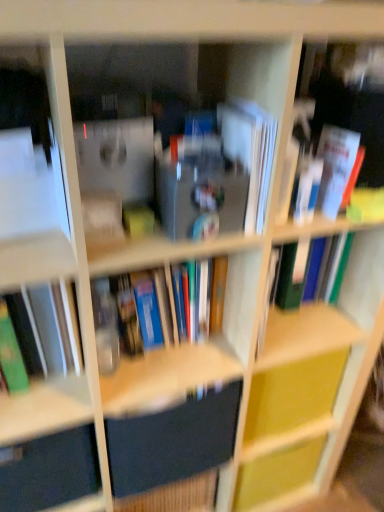
Find the location of a particular element. This screenshot has width=384, height=512. white paper book at right, marked as the third book in a left-to-right arrangement is located at coordinates (326, 174).

The image size is (384, 512). Find the location of `hardcover book at center, the second book in the left-to-right sequence`. hardcover book at center, the second book in the left-to-right sequence is located at coordinates (145, 308).

Describe the element at coordinates (145, 308) in the screenshot. I see `hardcover book at center, the second book in the left-to-right sequence` at that location.

How much space does white paper at center, arranged as the 2th paperback book when ordered from the bottom, occupy horizontally?

The width of white paper at center, arranged as the 2th paperback book when ordered from the bottom, is 8.80 inches.

At what (x,y) coordinates should I click in order to perform the action: click on yellow matte cabinet at center. Please return your answer as a coordinate pair (x, y). The width and height of the screenshot is (384, 512). Looking at the image, I should click on (293, 394).

Considering the relative positions of white paper book at right, marked as the third book in a left-to-right arrangement, and yellow matte cabinet at center in the image provided, is white paper book at right, marked as the third book in a left-to-right arrangement, to the right of yellow matte cabinet at center from the viewer's perspective?

Yes, white paper book at right, marked as the third book in a left-to-right arrangement, is to the right of yellow matte cabinet at center.

Considering the sizes of objects white paper book at right, which appears as the 2th book when viewed from the right, and yellow matte cabinet at center in the image provided, who is wider, white paper book at right, which appears as the 2th book when viewed from the right, or yellow matte cabinet at center?

With larger width is white paper book at right, which appears as the 2th book when viewed from the right.

Is white paper book at right, marked as the third book in a left-to-right arrangement, bigger or smaller than yellow matte cabinet at center?

Considering their sizes, white paper book at right, marked as the third book in a left-to-right arrangement, takes up less space than yellow matte cabinet at center.

Is yellow matte cabinet at center a part of white paper book at right, which appears as the 2th book when viewed from the right?

No.

Between hardcover book at center, the second book in the left-to-right sequence, and white paper at center, marked as the first paperback book in a top-to-bottom arrangement, which one has smaller width?

With smaller width is white paper at center, marked as the first paperback book in a top-to-bottom arrangement.

From the image's perspective, which one is positioned lower, hardcover book at center, the second book in the left-to-right sequence, or white paper at center, arranged as the 2th paperback book when ordered from the bottom?

From the image's view, hardcover book at center, the second book in the left-to-right sequence, is below.

From a real-world perspective, who is located higher, hardcover book at center, the second book in the left-to-right sequence, or white paper at center, marked as the first paperback book in a top-to-bottom arrangement?

white paper at center, marked as the first paperback book in a top-to-bottom arrangement, is physically above.

Is hardcover book at center, which ranks as the 3th book in right-to-left order, facing towards white paper at center, arranged as the 2th paperback book when ordered from the bottom?

No, hardcover book at center, which ranks as the 3th book in right-to-left order, is not facing towards white paper at center, arranged as the 2th paperback book when ordered from the bottom.

Measure the distance between matte black drawer at lower left and dark blue matte book at center, positioned as the second paperback book in top-to-bottom order.

They are 17.39 centimeters apart.

Considering the points (15, 498) and (221, 391), which point is behind, point (15, 498) or point (221, 391)?

The point (221, 391) is behind.

Based on their positions, is matte black drawer at lower left located to the left or right of dark blue matte book at center, positioned as the second paperback book in top-to-bottom order?

matte black drawer at lower left is positioned on dark blue matte book at center, positioned as the second paperback book in top-to-bottom order,'s left side.

Is matte black drawer at lower left next to dark blue matte book at center, positioned as the second paperback book in top-to-bottom order, and touching it?

matte black drawer at lower left is not next to dark blue matte book at center, positioned as the second paperback book in top-to-bottom order, and they're not touching.

Which of these two, hardcover book at center, the second book in the left-to-right sequence, or yellow matte cabinet at center, stands taller?

yellow matte cabinet at center.

Which object is further away from the camera taking this photo, hardcover book at center, the second book in the left-to-right sequence, or yellow matte cabinet at center?

Positioned behind is yellow matte cabinet at center.

From the picture: Do you think hardcover book at center, the second book in the left-to-right sequence, is within yellow matte cabinet at center, or outside of it?

hardcover book at center, the second book in the left-to-right sequence, lies outside yellow matte cabinet at center.

Does hardcover book at center, the second book in the left-to-right sequence, turn towards yellow matte cabinet at center?

No, hardcover book at center, the second book in the left-to-right sequence, does not turn towards yellow matte cabinet at center.

Which object is positioned more to the left, white paper at center, arranged as the 2th paperback book when ordered from the bottom, or hardcover book at center, which ranks as the 3th book in right-to-left order?

hardcover book at center, which ranks as the 3th book in right-to-left order, is more to the left.

Is white paper at center, marked as the first paperback book in a top-to-bottom arrangement, aimed at hardcover book at center, which ranks as the 3th book in right-to-left order?

No, white paper at center, marked as the first paperback book in a top-to-bottom arrangement, is not turned towards hardcover book at center, which ranks as the 3th book in right-to-left order.

Which point is more distant from viewer, (245, 230) or (95, 280)?

The point (95, 280) is farther from the camera.

Find the location of a particular element. book that is the 1st one when counting downward from the white paper at center, arranged as the 2th paperback book when ordered from the bottom (from the image's perspective) is located at coordinates (145, 308).

In the scene shown: Which object is further away from the camera taking this photo, yellow matte cabinet at center or white paper at center, marked as the first paperback book in a top-to-bottom arrangement?

yellow matte cabinet at center is further from the camera.

From a real-world perspective, between yellow matte cabinet at center and white paper at center, marked as the first paperback book in a top-to-bottom arrangement, who is vertically higher?

white paper at center, marked as the first paperback book in a top-to-bottom arrangement.

From the image's perspective, is yellow matte cabinet at center above white paper at center, marked as the first paperback book in a top-to-bottom arrangement?

No, from the image's perspective, yellow matte cabinet at center is not over white paper at center, marked as the first paperback book in a top-to-bottom arrangement.

The height and width of the screenshot is (512, 384). I want to click on paperback book above the yellow matte cabinet at center (from the image's perspective), so click(250, 152).

In the image, is dark blue matte book at center, marked as the first paperback book in a bottom-to-top arrangement, positioned in front of or behind green matte book at left, acting as the 1th book starting from the left?

Clearly, dark blue matte book at center, marked as the first paperback book in a bottom-to-top arrangement, is behind green matte book at left, acting as the 1th book starting from the left.

Is dark blue matte book at center, marked as the first paperback book in a bottom-to-top arrangement, next to green matte book at left, which ranks as the 4th book in right-to-left order?

No, dark blue matte book at center, marked as the first paperback book in a bottom-to-top arrangement, is not beside green matte book at left, which ranks as the 4th book in right-to-left order.

The height and width of the screenshot is (512, 384). I want to click on paperback book behind the green matte book at left, which ranks as the 4th book in right-to-left order, so click(x=173, y=441).

Can you confirm if dark blue matte book at center, positioned as the second paperback book in top-to-bottom order, is positioned to the right of green matte book at left, acting as the 1th book starting from the left?

Yes, dark blue matte book at center, positioned as the second paperback book in top-to-bottom order, is to the right of green matte book at left, acting as the 1th book starting from the left.

I want to click on cabinet located behind the white paper book at right, marked as the third book in a left-to-right arrangement, so click(x=293, y=394).

Which book is the 1st one when counting from the left side of the white paper at center, arranged as the 2th paperback book when ordered from the bottom? Please provide its 2D coordinates.

[(145, 308)]

Estimate the real-world distances between objects in this image. Which object is closer to yellow matte cabinet at center, matte black drawer at lower left or green matte book at left, acting as the 1th book starting from the left?

matte black drawer at lower left lies closer to yellow matte cabinet at center than the other object.

Considering their positions, is white paper book at right, which appears as the 2th book when viewed from the right, positioned further to matte black drawer at lower left than dark blue matte book at center, positioned as the second paperback book in top-to-bottom order?

white paper book at right, which appears as the 2th book when viewed from the right.

Which object lies nearer to the anchor point white paper book at right, marked as the third book in a left-to-right arrangement, white paper book at upper right, the 1th book in the right-to-left sequence, or green matte book at left, acting as the 1th book starting from the left?

Based on the image, white paper book at upper right, the 1th book in the right-to-left sequence, appears to be nearer to white paper book at right, marked as the third book in a left-to-right arrangement.

Based on their spatial positions, is white paper book at upper right, which appears as the 4th book when viewed from the left, or hardcover book at center, the second book in the left-to-right sequence, closer to green matte book at left, which ranks as the 4th book in right-to-left order?

hardcover book at center, the second book in the left-to-right sequence, is positioned closer to the anchor green matte book at left, which ranks as the 4th book in right-to-left order.

From the image, which object appears to be farther from white paper book at right, marked as the third book in a left-to-right arrangement, white paper at center, marked as the first paperback book in a top-to-bottom arrangement, or hardcover book at center, which ranks as the 3th book in right-to-left order?

The object further to white paper book at right, marked as the third book in a left-to-right arrangement, is hardcover book at center, which ranks as the 3th book in right-to-left order.

Looking at the image, which one is located closer to matte black drawer at lower left, white paper book at upper right, which appears as the 4th book when viewed from the left, or green matte book at left, acting as the 1th book starting from the left?

The object closer to matte black drawer at lower left is green matte book at left, acting as the 1th book starting from the left.

Considering their positions, is dark blue matte book at center, marked as the first paperback book in a bottom-to-top arrangement, positioned closer to hardcover book at center, the second book in the left-to-right sequence, than yellow matte cabinet at center?

dark blue matte book at center, marked as the first paperback book in a bottom-to-top arrangement, is positioned closer to the anchor hardcover book at center, the second book in the left-to-right sequence.

Which object lies nearer to the anchor point white paper at center, marked as the first paperback book in a top-to-bottom arrangement, dark blue matte book at center, positioned as the second paperback book in top-to-bottom order, or hardcover book at center, which ranks as the 3th book in right-to-left order?

hardcover book at center, which ranks as the 3th book in right-to-left order, is positioned closer to the anchor white paper at center, marked as the first paperback book in a top-to-bottom arrangement.

Find the location of `cabinet between white paper at center, marked as the first paperback book in a top-to-bottom arrangement, and dark blue matte book at center, positioned as the second paperback book in top-to-bottom order, vertically`. cabinet between white paper at center, marked as the first paperback book in a top-to-bottom arrangement, and dark blue matte book at center, positioned as the second paperback book in top-to-bottom order, vertically is located at coordinates (293, 394).

Find the location of a particular element. The width and height of the screenshot is (384, 512). cabinet that lies between white paper book at upper right, which appears as the 4th book when viewed from the left, and dark blue matte book at center, marked as the first paperback book in a bottom-to-top arrangement, from top to bottom is located at coordinates (293, 394).

Identify the location of book between hardcover book at center, the second book in the left-to-right sequence, and matte black drawer at lower left from top to bottom. This screenshot has width=384, height=512. (42, 329).

The height and width of the screenshot is (512, 384). I want to click on cabinet that lies between white paper at center, marked as the first paperback book in a top-to-bottom arrangement, and matte black drawer at lower left from top to bottom, so click(x=293, y=394).